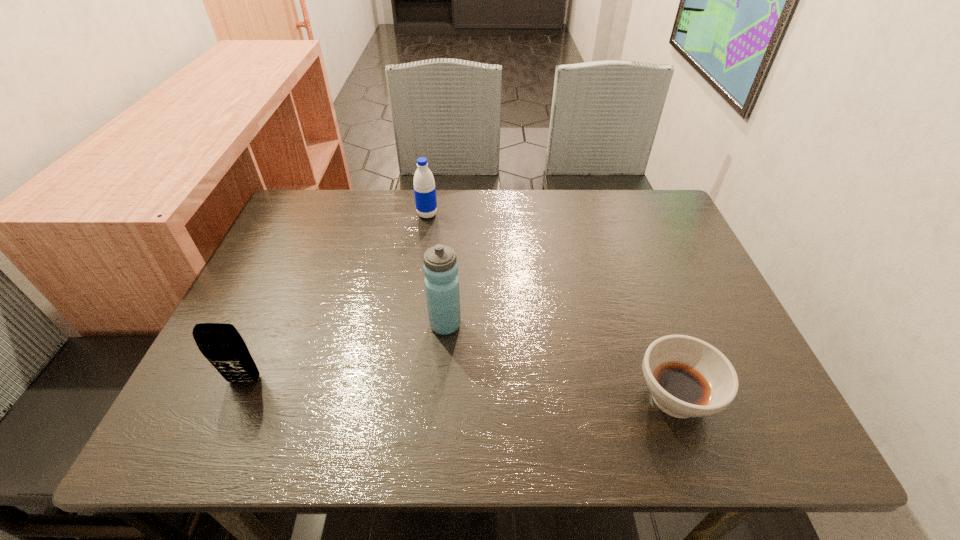
Locate an element on the screen. blank region between the cellular telephone and the farther water bottle is located at coordinates (336, 298).

Identify the location of vacant space that is in between the taller water bottle and the soup bowl. (561, 361).

Identify which object is the closest to the second object from left to right. Please provide its 2D coordinates. Your answer should be formatted as a tuple, i.e. [(x, y)], where the tuple contains the x and y coordinates of a point satisfying the conditions above.

[(440, 267)]

Locate which object ranks second in proximity to the shortest object. Please provide its 2D coordinates. Your answer should be formatted as a tuple, i.e. [(x, y)], where the tuple contains the x and y coordinates of a point satisfying the conditions above.

[(424, 185)]

This screenshot has height=540, width=960. I want to click on free spot that satisfies the following two spatial constraints: 1. on the screen of the shortest object; 2. on the right side of the cellular telephone, so click(x=236, y=397).

The width and height of the screenshot is (960, 540). Identify the location of vacant position in the image that satisfies the following two spatial constraints: 1. on the screen of the soup bowl; 2. on the left side of the cellular telephone. (236, 397).